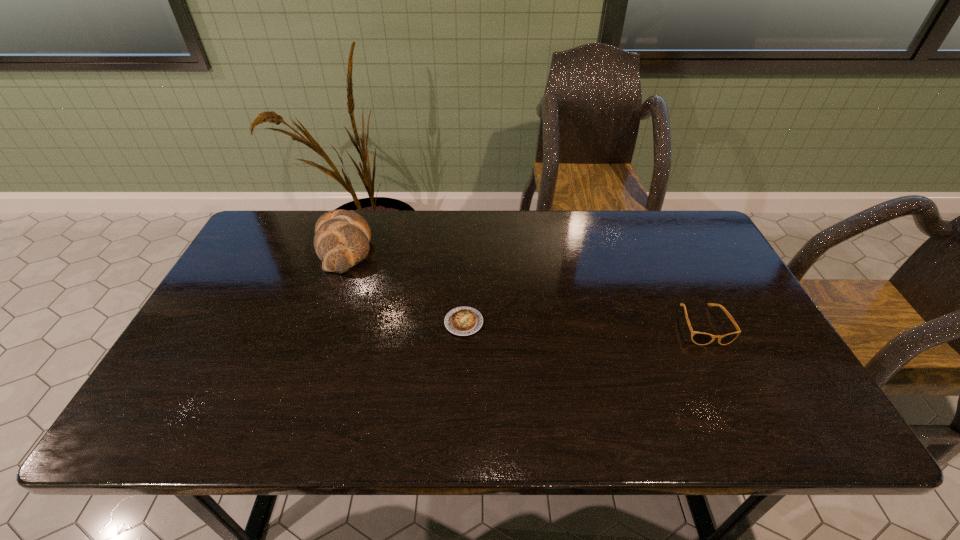
Locate an element on the screen. The height and width of the screenshot is (540, 960). free spot between the farthest object and the quiche is located at coordinates (404, 285).

Identify the location of empty space that is in between the second object from left to right and the tallest object. The image size is (960, 540). (404, 285).

Where is `free space that is in between the quiche and the second tallest object`? free space that is in between the quiche and the second tallest object is located at coordinates (584, 324).

Image resolution: width=960 pixels, height=540 pixels. Identify the location of free space between the shortest object and the second shortest object. (584, 324).

This screenshot has height=540, width=960. I want to click on free spot between the rightmost object and the farthest object, so click(x=524, y=286).

Image resolution: width=960 pixels, height=540 pixels. Find the location of `free space between the rightmost object and the shortest object`. free space between the rightmost object and the shortest object is located at coordinates (584, 324).

You are a GUI agent. You are given a task and a screenshot of the screen. Output one action in this format:
    pyautogui.click(x=<x>, y=<y>)
    Task: Click on the object that is the second closest one to the quiche
    The width and height of the screenshot is (960, 540).
    Given the screenshot: What is the action you would take?
    pyautogui.click(x=700, y=338)

Locate which object ranks in proximity to the shortest object. Please provide its 2D coordinates. Your answer should be formatted as a tuple, i.e. [(x, y)], where the tuple contains the x and y coordinates of a point satisfying the conditions above.

[(341, 241)]